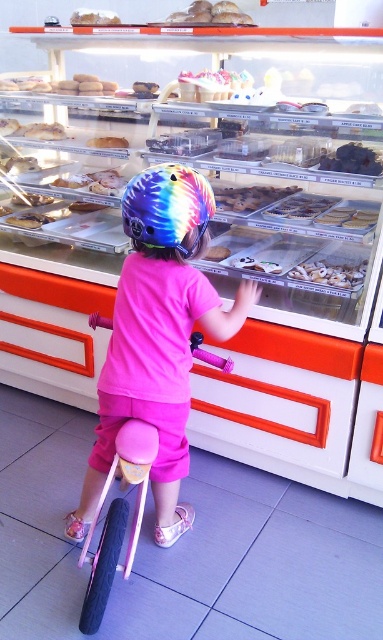
Question: Observing the image, what is the correct spatial positioning of pink matte bicycle at center in reference to smooth white bread at upper center?

Choices:
 (A) left
 (B) right

Answer: (B)

Question: Is rainbow helmet at center closer to the viewer compared to smooth chocolate cookie at center?

Choices:
 (A) no
 (B) yes

Answer: (B)

Question: Considering the real-world distances, which object is closest to the smooth chocolate cookie at center?

Choices:
 (A) smooth white bread at upper center
 (B) rainbow helmet at center
 (C) pink matte bicycle at center

Answer: (B)

Question: Which point is farther from the camera taking this photo?

Choices:
 (A) (116, 141)
 (B) (80, 556)
 (C) (212, 246)
 (D) (234, 328)

Answer: (A)

Question: Which of the following is the closest to the observer?

Choices:
 (A) smooth white bread at upper center
 (B) smooth chocolate cookie at center
 (C) pink matte bicycle at center

Answer: (C)

Question: Can you confirm if rainbow helmet at center is positioned to the right of pink matte bicycle at center?

Choices:
 (A) yes
 (B) no

Answer: (A)